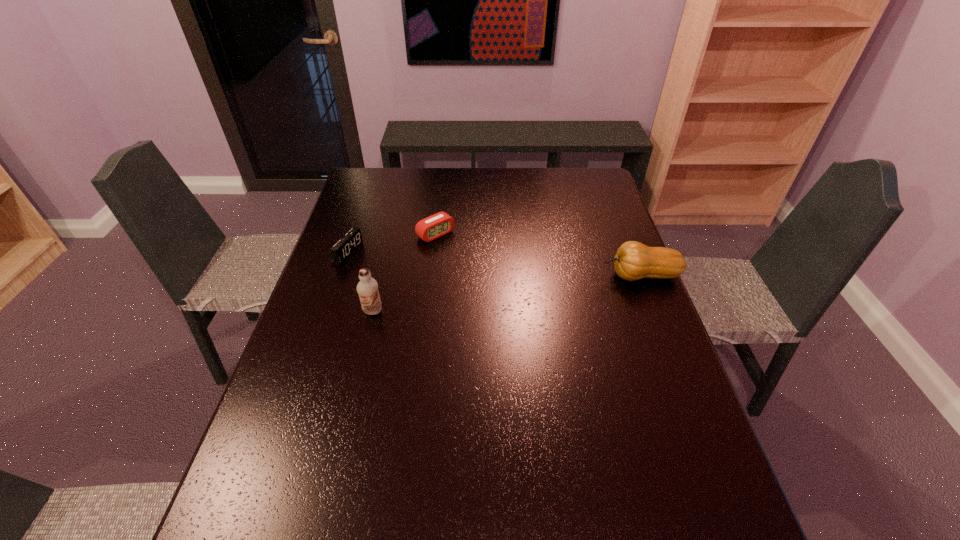
In order to click on free space between the second tallest object and the third object from left to right in this screenshot , I will do `click(539, 255)`.

Image resolution: width=960 pixels, height=540 pixels. In order to click on the second closest object relative to the chocolate milk in this screenshot , I will do `click(428, 229)`.

Point out which object is positioned as the second nearest to the right alarm clock. Please provide its 2D coordinates. Your answer should be formatted as a tuple, i.e. [(x, y)], where the tuple contains the x and y coordinates of a point satisfying the conditions above.

[(367, 288)]

Where is `vacant space that satisfies the following two spatial constraints: 1. on the front side of the gourd; 2. on the stem side of the right alarm clock`? This screenshot has height=540, width=960. vacant space that satisfies the following two spatial constraints: 1. on the front side of the gourd; 2. on the stem side of the right alarm clock is located at coordinates (431, 275).

Where is `vacant space that satisfies the following two spatial constraints: 1. on the front side of the rightmost object; 2. on the stem side of the right alarm clock`? The width and height of the screenshot is (960, 540). vacant space that satisfies the following two spatial constraints: 1. on the front side of the rightmost object; 2. on the stem side of the right alarm clock is located at coordinates (431, 275).